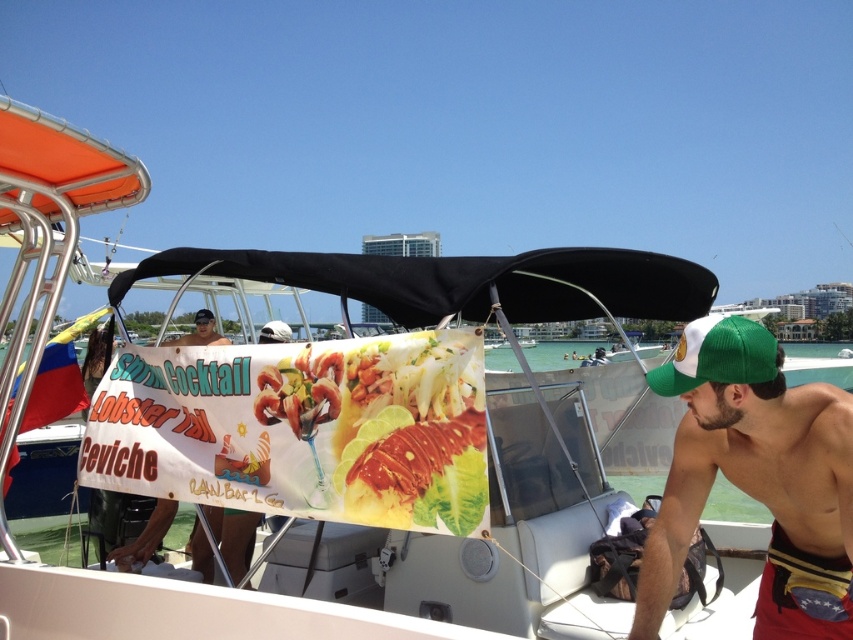
You are standing on the boat and want to find the green fabric baseball cap at right. According to the coordinates provided, where should you look relative to the banner?

The green fabric baseball cap at right is located at coordinates point (717, 355), which places it to the right side of the banner.

You are a photographer standing on the boat and want to take a photo of both the shiny lobster at center and the matte black signboard at center. Which object should you focus on first to ensure both are in clear view?

The shiny lobster at center is closer to the viewer than the matte black signboard at center, so you should focus on the shiny lobster at center first to ensure both are in clear view.